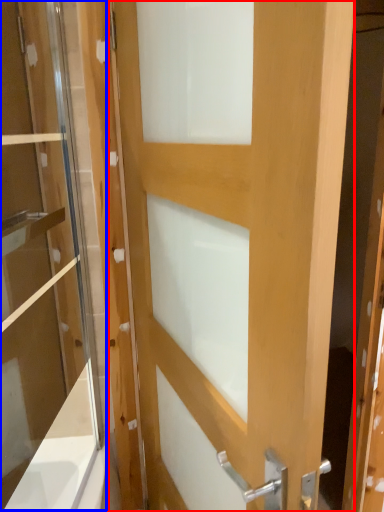
Question: Among these objects, which one is farthest to the camera, door (highlighted by a red box) or screen door (highlighted by a blue box)?

Choices:
 (A) door
 (B) screen door

Answer: (B)